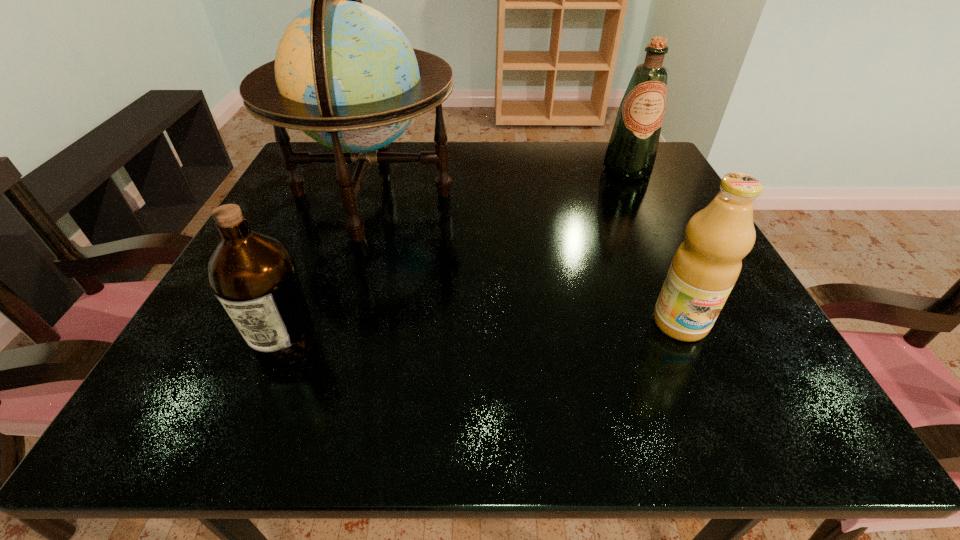
Identify the location of object that is at the far left corner. Image resolution: width=960 pixels, height=540 pixels. (345, 74).

The height and width of the screenshot is (540, 960). I want to click on object that is at the far right corner, so (x=632, y=149).

The height and width of the screenshot is (540, 960). I want to click on vacant space at the far edge, so click(381, 183).

This screenshot has width=960, height=540. I want to click on vacant area at the near edge, so click(637, 424).

At what (x,y) coordinates should I click in order to perform the action: click on vacant space at the left edge of the desktop. Please return your answer as a coordinate pair (x, y). This screenshot has width=960, height=540. Looking at the image, I should click on (271, 230).

Image resolution: width=960 pixels, height=540 pixels. I want to click on vacant space at the right edge of the desktop, so click(655, 234).

Where is `vacant space at the far left corner of the desktop`? Image resolution: width=960 pixels, height=540 pixels. vacant space at the far left corner of the desktop is located at coordinates (330, 165).

Find the location of a particular element. The height and width of the screenshot is (540, 960). vacant region at the far right corner of the desktop is located at coordinates (614, 186).

The image size is (960, 540). I want to click on vacant area at the near right corner, so click(704, 414).

This screenshot has height=540, width=960. Identify the location of unoccupied area between the farthest olive oil and the globe. (500, 181).